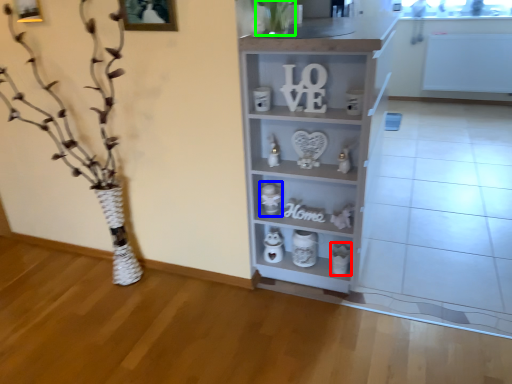
Question: Estimate the real-world distances between objects in this image. Which object is farther from toy (highlighted by a red box), toy (highlighted by a blue box) or plant (highlighted by a green box)?

Choices:
 (A) toy
 (B) plant

Answer: (B)